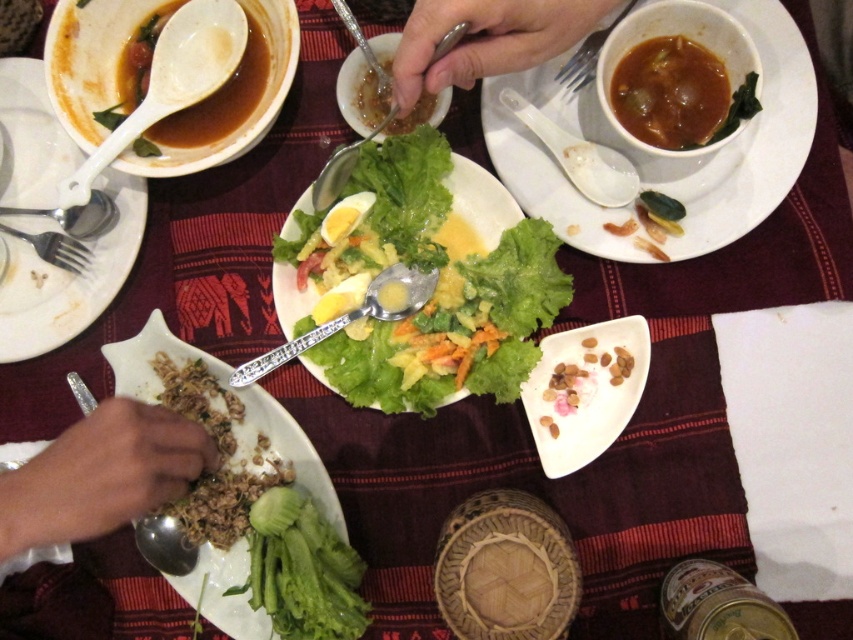
Question: Among these objects, which one is farthest from the camera?

Choices:
 (A) brown matte bowl at upper center
 (B) brown crumbly rice at lower left
 (C) brown matte soup at upper right
 (D) slightly browned broth at center

Answer: (D)

Question: Can you confirm if white ceramic plate at center is positioned above brown matte soup at upper left?

Choices:
 (A) no
 (B) yes

Answer: (A)

Question: Which point appears farthest from the camera in this image?

Choices:
 (A) (234, 125)
 (B) (199, 58)
 (C) (405, 129)
 (D) (241, 429)

Answer: (C)

Question: Is white matte plate at upper left thinner than silver spoon at lower left?

Choices:
 (A) yes
 (B) no

Answer: (B)

Question: Among these points, which one is farthest from the camera?

Choices:
 (A) (148, 522)
 (B) (160, 109)
 (C) (689, 211)
 (D) (550, 371)

Answer: (D)

Question: Considering the relative positions of brown matte soup at upper left and white creamy nuts at center in the image provided, where is brown matte soup at upper left located with respect to white creamy nuts at center?

Choices:
 (A) left
 (B) right

Answer: (A)